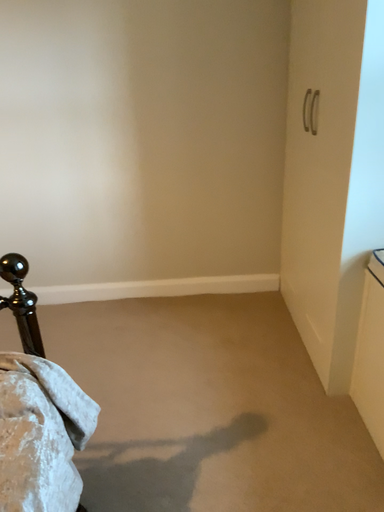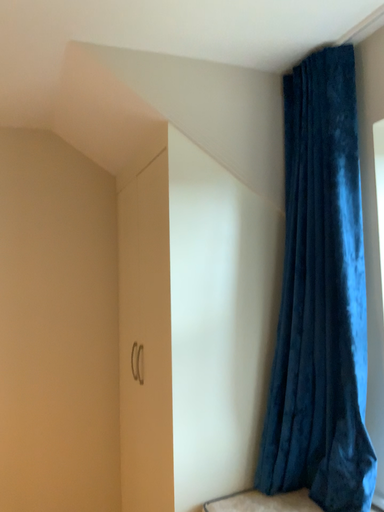
Question: How did the camera likely rotate when shooting the video?

Choices:
 (A) rotated right
 (B) rotated left

Answer: (A)